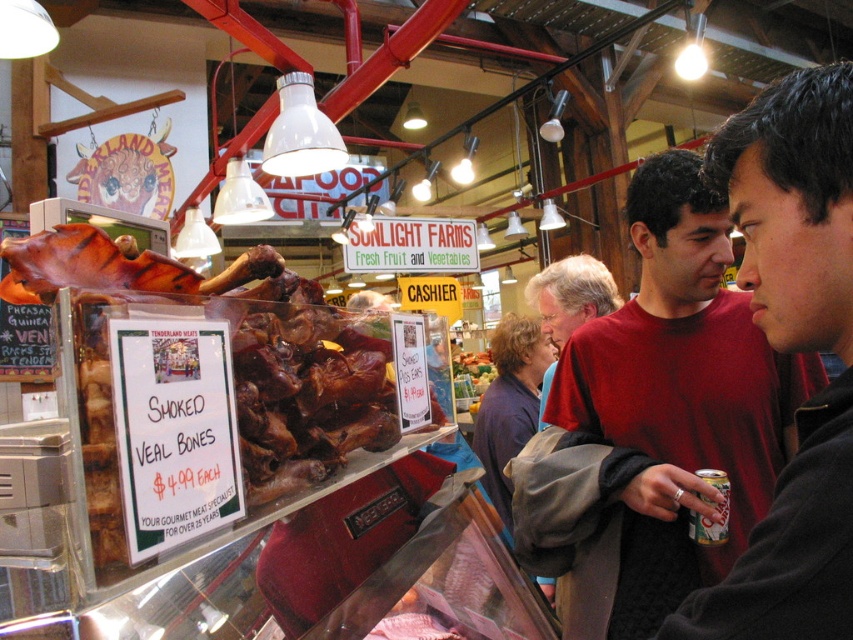
Question: Is the position of red cotton shirt at center less distant than that of matte red shirt at center?

Choices:
 (A) no
 (B) yes

Answer: (B)

Question: Among these points, which one is nearest to the camera?

Choices:
 (A) (664, 400)
 (B) (512, 403)

Answer: (A)

Question: Where is red cotton shirt at center located in relation to matte red shirt at center in the image?

Choices:
 (A) above
 (B) below

Answer: (B)

Question: Which point is closer to the camera?

Choices:
 (A) (669, 266)
 (B) (546, 288)
 (C) (511, 449)

Answer: (A)

Question: Does dark blue sweater at center lie behind matte red shirt at center?

Choices:
 (A) no
 (B) yes

Answer: (B)

Question: Which point is closer to the camera?

Choices:
 (A) (633, 452)
 (B) (523, 365)
 (C) (590, 298)

Answer: (A)